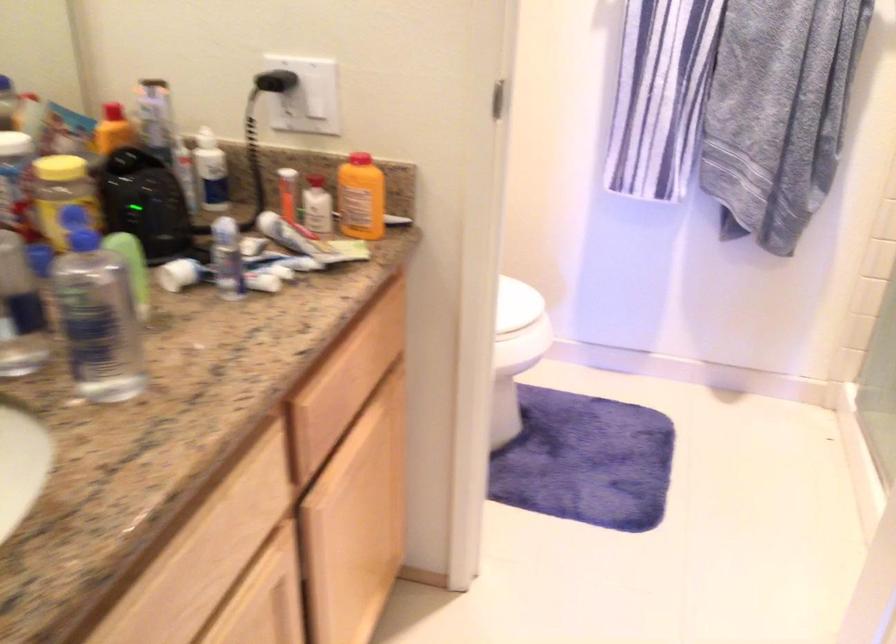
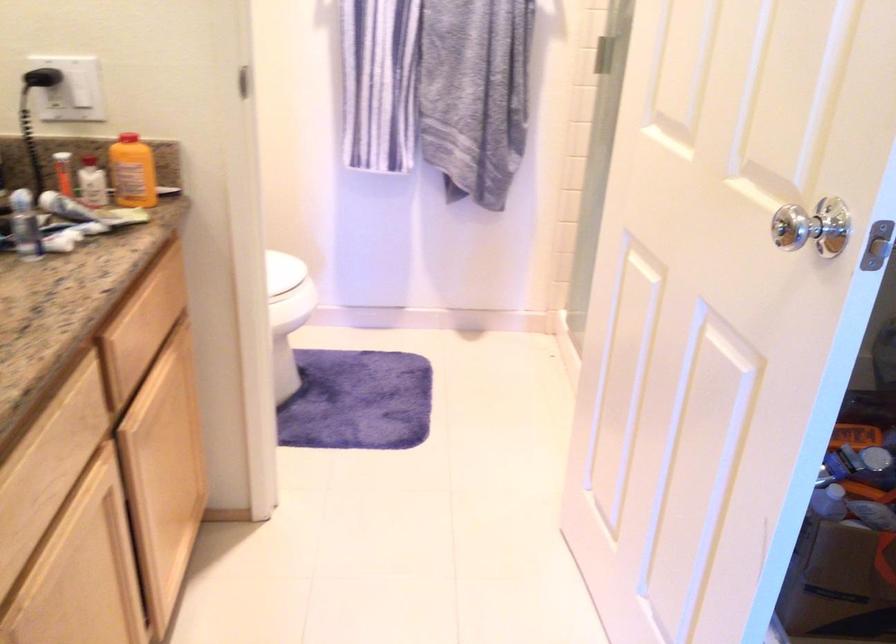
In the second image, find the point that corresponds to the point at 519,304 in the first image.

(282, 270)